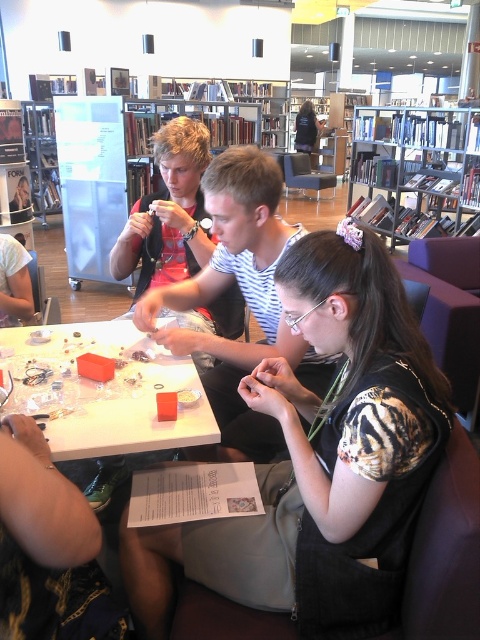
Question: Which of the following is the farthest from the observer?

Choices:
 (A) (462, 150)
 (B) (304, 134)
 (C) (245, 100)

Answer: (B)

Question: Considering the relative positions of matte black shirt at center and metallic silver bookshelf at upper center in the image provided, where is matte black shirt at center located with respect to metallic silver bookshelf at upper center?

Choices:
 (A) below
 (B) above

Answer: (A)

Question: Does white plastic table at center appear on the right side of dark blue shirt at center?

Choices:
 (A) yes
 (B) no

Answer: (B)

Question: Which point is closer to the camera taking this photo?

Choices:
 (A) (437, 108)
 (B) (307, 147)
 (C) (105, 436)
 (D) (182, 93)

Answer: (C)

Question: Is matte black shirt at center wider than metallic silver bookshelf at upper right?

Choices:
 (A) yes
 (B) no

Answer: (B)

Question: Which point is farther to the camera?

Choices:
 (A) (75, 440)
 (B) (325, 481)

Answer: (A)